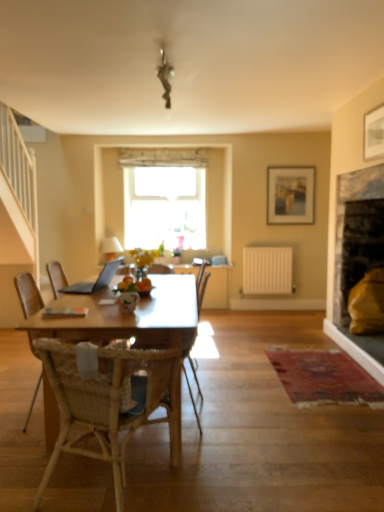
This screenshot has height=512, width=384. I want to click on free point to the right of woven wood chair at center, which is counted as the second chair, starting from the back, so click(x=291, y=417).